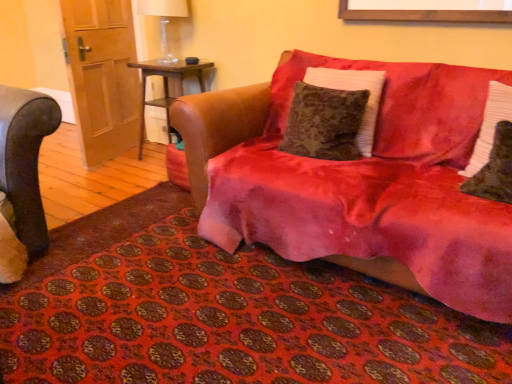
What do you see at coordinates (324, 122) in the screenshot? I see `velvet brown pillow at center, the 1th pillow when ordered from left to right` at bounding box center [324, 122].

The width and height of the screenshot is (512, 384). What do you see at coordinates (163, 20) in the screenshot?
I see `transparent glass table lamp at upper left` at bounding box center [163, 20].

This screenshot has width=512, height=384. What do you see at coordinates (223, 313) in the screenshot? I see `velvet red mat at lower center` at bounding box center [223, 313].

The image size is (512, 384). Describe the element at coordinates (494, 169) in the screenshot. I see `velvet black pillow at right, which is the 2th pillow in left-to-right order` at that location.

Locate an element on the screen. This screenshot has width=512, height=384. wooden side table at center is located at coordinates (166, 87).

Measure the distance between velvet red couch at center and camera.

The depth of velvet red couch at center is 4.62 feet.

What do you see at coordinates (357, 182) in the screenshot? This screenshot has height=384, width=512. I see `velvet red couch at center` at bounding box center [357, 182].

What are the coordinates of `velvet brown pillow at center, placed as the third pillow when sorted from right to left` in the screenshot? It's located at (324, 122).

From their relative heights in the image, would you say transparent glass table lamp at upper left is taller or shorter than velvet red mat at lower center?

Clearly, transparent glass table lamp at upper left is taller compared to velvet red mat at lower center.

Is transparent glass table lamp at upper left far away from velvet red mat at lower center?

That's right, there is a large distance between transparent glass table lamp at upper left and velvet red mat at lower center.

Can you tell me how much transparent glass table lamp at upper left and velvet red mat at lower center differ in facing direction?

The facing directions of transparent glass table lamp at upper left and velvet red mat at lower center are 90 degrees apart.

Considering the positions of point (144, 98) and point (237, 193), is point (144, 98) closer or farther from the camera than point (237, 193)?

Point (144, 98) appears to be farther away from the viewer than point (237, 193).

From the image's perspective, which one is positioned higher, wooden side table at center or velvet red couch at center?

From the image's view, wooden side table at center is above.

Between wooden side table at center and velvet red couch at center, which one has smaller size?

Smaller between the two is wooden side table at center.

Between wooden side table at center and velvet red couch at center, which one is positioned behind?

wooden side table at center is further away from the camera.

Considering the relative positions of velvet black pillow at right, which appears as the second pillow when viewed from the right, and velvet red mat at lower center in the image provided, is velvet black pillow at right, which appears as the second pillow when viewed from the right, to the left of velvet red mat at lower center from the viewer's perspective?

In fact, velvet black pillow at right, which appears as the second pillow when viewed from the right, is to the right of velvet red mat at lower center.

Is velvet black pillow at right, which is the 2th pillow in left-to-right order, touching velvet red mat at lower center?

They are not placed beside each other.

Is wooden door at left a part of transparent glass table lamp at upper left?

Definitely not — wooden door at left is not inside transparent glass table lamp at upper left.

Is transparent glass table lamp at upper left closer to camera compared to wooden door at left?

No, transparent glass table lamp at upper left is further to the viewer.

Measure the distance between transparent glass table lamp at upper left and wooden door at left.

The distance of transparent glass table lamp at upper left from wooden door at left is 19.01 inches.

Is transparent glass table lamp at upper left oriented away from wooden door at left?

No, wooden door at left is not at the back of transparent glass table lamp at upper left.

Consider the image. Would you say velvet red mat at lower center is to the left or to the right of velvet red couch at center in the picture?

velvet red mat at lower center is to the left of velvet red couch at center.

Can you tell me how much velvet red mat at lower center and velvet red couch at center differ in facing direction?

The angular difference between velvet red mat at lower center and velvet red couch at center is 89.9 degrees.

Would you say velvet red mat at lower center is outside velvet red couch at center?

Indeed, velvet red mat at lower center is completely outside velvet red couch at center.

The image size is (512, 384). Find the location of `mat below the velvet red couch at center (from a real-world perspective)`. mat below the velvet red couch at center (from a real-world perspective) is located at coordinates (223, 313).

Considering the sizes of objects velvet brown pillow at center, placed as the third pillow when sorted from right to left, and white textured pillow at right, which ranks as the third pillow in left-to-right order, in the image provided, who is bigger, velvet brown pillow at center, placed as the third pillow when sorted from right to left, or white textured pillow at right, which ranks as the third pillow in left-to-right order,?

velvet brown pillow at center, placed as the third pillow when sorted from right to left, is bigger.

Does velvet brown pillow at center, the 1th pillow when ordered from left to right, turn towards white textured pillow at right, positioned as the first pillow in right-to-left order?

No, velvet brown pillow at center, the 1th pillow when ordered from left to right, is not aimed at white textured pillow at right, positioned as the first pillow in right-to-left order.

What are the coordinates of `pillow above the white textured pillow at right, which ranks as the third pillow in left-to-right order (from the image's perspective)` in the screenshot? It's located at (324, 122).

Are velvet brown pillow at center, the 1th pillow when ordered from left to right, and white textured pillow at right, positioned as the first pillow in right-to-left order, located far from each other?

No, velvet brown pillow at center, the 1th pillow when ordered from left to right, is not far away from white textured pillow at right, positioned as the first pillow in right-to-left order.

From a real-world perspective, is transparent glass table lamp at upper left on top of velvet brown pillow at center, the 1th pillow when ordered from left to right?

Correct, in the physical world, transparent glass table lamp at upper left is higher than velvet brown pillow at center, the 1th pillow when ordered from left to right.

From the picture: From the image's perspective, is transparent glass table lamp at upper left located above or below velvet brown pillow at center, placed as the third pillow when sorted from right to left?

transparent glass table lamp at upper left is situated higher than velvet brown pillow at center, placed as the third pillow when sorted from right to left, in the image.

Is point (177, 0) closer or farther from the camera than point (324, 152)?

Point (177, 0) is positioned farther from the camera compared to point (324, 152).

Is transparent glass table lamp at upper left positioned far away from velvet brown pillow at center, the 1th pillow when ordered from left to right?

Indeed, transparent glass table lamp at upper left is not near velvet brown pillow at center, the 1th pillow when ordered from left to right.

Identify the location of table lamp that appears on the left of velvet red mat at lower center. This screenshot has width=512, height=384. (163, 20).

Where is `table that appears behind the velvet red couch at center`? table that appears behind the velvet red couch at center is located at coordinates point(166,87).

Based on their spatial positions, is velvet red mat at lower center or transparent glass table lamp at upper left closer to velvet black pillow at right, which appears as the second pillow when viewed from the right?

velvet red mat at lower center is positioned closer to the anchor velvet black pillow at right, which appears as the second pillow when viewed from the right.

Based on their spatial positions, is velvet red couch at center or wooden side table at center further from velvet brown pillow at center, the 1th pillow when ordered from left to right?

wooden side table at center.

Looking at this image, when comparing their distances from velvet brown pillow at center, placed as the third pillow when sorted from right to left, does white textured pillow at right, positioned as the first pillow in right-to-left order, or wooden side table at center seem closer?

white textured pillow at right, positioned as the first pillow in right-to-left order, is closer to velvet brown pillow at center, placed as the third pillow when sorted from right to left.

Based on their spatial positions, is velvet red couch at center or white textured pillow at right, which ranks as the third pillow in left-to-right order, further from wooden side table at center?

white textured pillow at right, which ranks as the third pillow in left-to-right order, lies further to wooden side table at center than the other object.

In the scene shown: Based on their spatial positions, is wooden door at left or velvet red mat at lower center further from transparent glass table lamp at upper left?

velvet red mat at lower center is positioned further to the anchor transparent glass table lamp at upper left.

Looking at the image, which one is located closer to velvet red couch at center, velvet brown pillow at center, placed as the third pillow when sorted from right to left, or velvet red mat at lower center?

velvet brown pillow at center, placed as the third pillow when sorted from right to left, lies closer to velvet red couch at center than the other object.

Looking at the image, which one is located further to velvet black pillow at right, which is the 2th pillow in left-to-right order, transparent glass table lamp at upper left or velvet brown pillow at center, placed as the third pillow when sorted from right to left?

transparent glass table lamp at upper left.

Based on their spatial positions, is transparent glass table lamp at upper left or velvet brown pillow at center, placed as the third pillow when sorted from right to left, further from white textured pillow at right, which ranks as the third pillow in left-to-right order?

Among the two, transparent glass table lamp at upper left is located further to white textured pillow at right, which ranks as the third pillow in left-to-right order.

Where is `door between velvet red couch at center and wooden side table at center along the z-axis`? door between velvet red couch at center and wooden side table at center along the z-axis is located at coordinates (102, 76).

Identify the location of table lamp between velvet brown pillow at center, the 1th pillow when ordered from left to right, and wooden side table at center in the front-back direction. The height and width of the screenshot is (384, 512). coord(163,20).

Identify the location of pillow between velvet red couch at center and white textured pillow at right, which ranks as the third pillow in left-to-right order, from left to right. The width and height of the screenshot is (512, 384). (494, 169).

Locate an element on the screen. This screenshot has width=512, height=384. studio couch between wooden door at left and velvet black pillow at right, which is the 2th pillow in left-to-right order, from left to right is located at coordinates (357, 182).